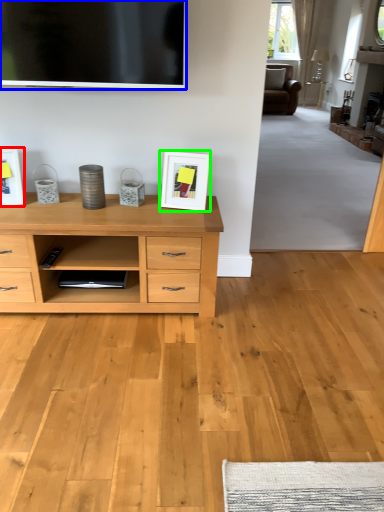
Question: Considering the real-world distances, which object is closest to picture frame (highlighted by a red box)? television (highlighted by a blue box) or picture frame (highlighted by a green box).

Choices:
 (A) television
 (B) picture frame

Answer: (A)